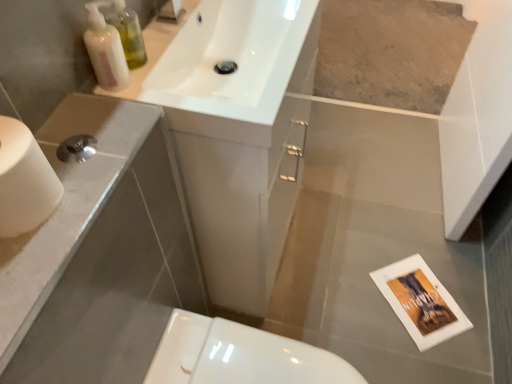
Where is `free point behind white matte toilet paper at left`? free point behind white matte toilet paper at left is located at coordinates (86, 123).